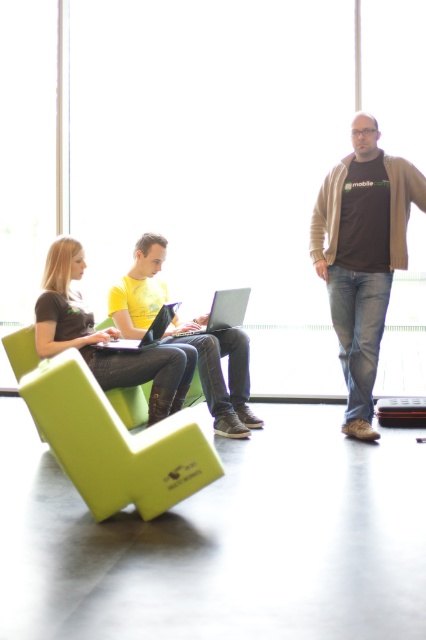
In the scene shown: You are organizing a meeting in this room and need to place two matte black laptops. According to the scene, where should the matte black laptop at left be placed relative to the matte black laptop at center?

The matte black laptop at left should be placed on the left side of the matte black laptop at center as per the scene description.

You are standing in the room shown in the image. There is a point marked at coordinates [109,436]. What object is located at that point?

The point at coordinates [109,436] indicates the green foam armchair at lower left.